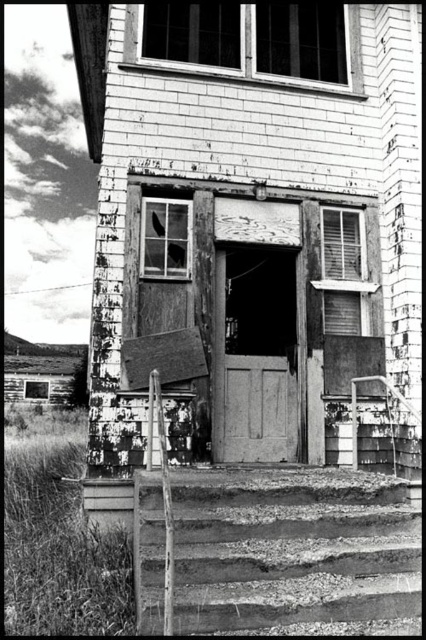
Question: Is rusty metal stairs at center closer to the viewer compared to smooth wooden door at center?

Choices:
 (A) yes
 (B) no

Answer: (A)

Question: Which object appears farthest from the camera in this image?

Choices:
 (A) rusty metal stairs at center
 (B) smooth wooden door at center

Answer: (B)

Question: Is rusty metal stairs at center below smooth wooden door at center?

Choices:
 (A) yes
 (B) no

Answer: (A)

Question: Does rusty metal stairs at center appear on the right side of smooth wooden door at center?

Choices:
 (A) yes
 (B) no

Answer: (A)

Question: Which of the following is the closest to the observer?

Choices:
 (A) rusty metal stairs at center
 (B) smooth wooden door at center

Answer: (A)